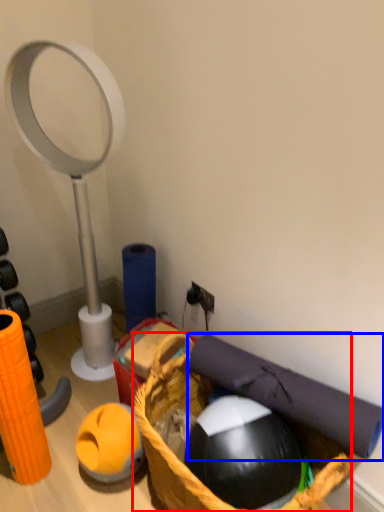
Question: Which object is closer to the camera taking this photo, basket (highlighted by a red box) or yoga mat (highlighted by a blue box)?

Choices:
 (A) basket
 (B) yoga mat

Answer: (A)